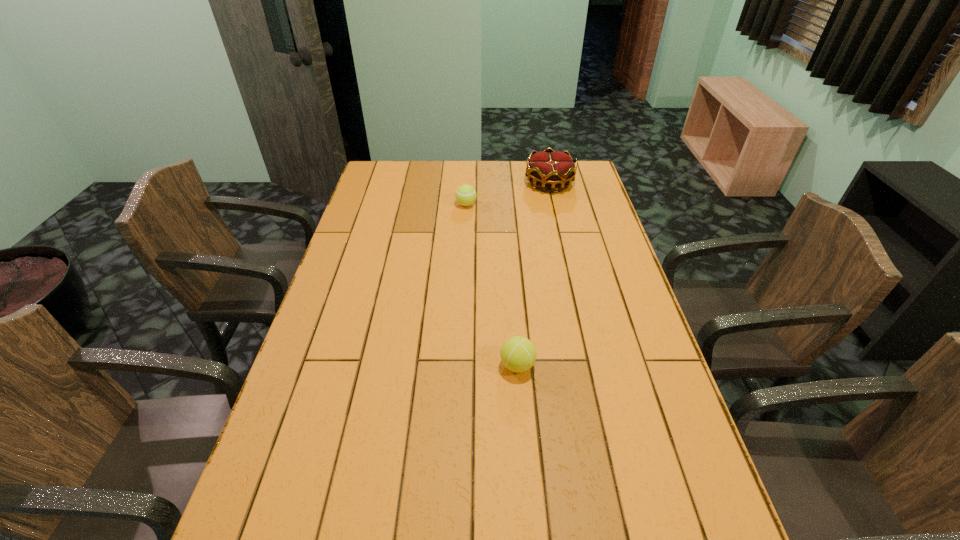
In order to click on vacant area that lies between the nearest object and the second nearest object in this screenshot , I will do `click(492, 285)`.

Identify the location of vacant space that's between the farther tennis ball and the nearest object. (492, 285).

Locate an element on the screen. Image resolution: width=960 pixels, height=540 pixels. free spot between the second object from right to left and the left tennis ball is located at coordinates (492, 285).

The height and width of the screenshot is (540, 960). What are the coordinates of `free space that is in between the farther tennis ball and the tallest object` in the screenshot? It's located at (508, 194).

This screenshot has width=960, height=540. Identify the location of free area in between the farther tennis ball and the farthest object. (508, 194).

You are a GUI agent. You are given a task and a screenshot of the screen. Output one action in this format:
    pyautogui.click(x=<x>, y=<y>)
    Task: Click on the object that is the nearest to the right tennis ball
    The width and height of the screenshot is (960, 540).
    Given the screenshot: What is the action you would take?
    pyautogui.click(x=465, y=195)

Where is `object that stands as the second closest to the nearest object`? The width and height of the screenshot is (960, 540). object that stands as the second closest to the nearest object is located at coordinates (550, 168).

At what (x,y) coordinates should I click in order to perform the action: click on vacant region that satisfies the following two spatial constraints: 1. on the back side of the rightmost object; 2. on the right side of the leftmost object. Please return your answer as a coordinate pair (x, y). The height and width of the screenshot is (540, 960). Looking at the image, I should click on (467, 183).

I want to click on vacant space that satisfies the following two spatial constraints: 1. on the front side of the second farthest object; 2. on the right side of the nearer tennis ball, so click(459, 366).